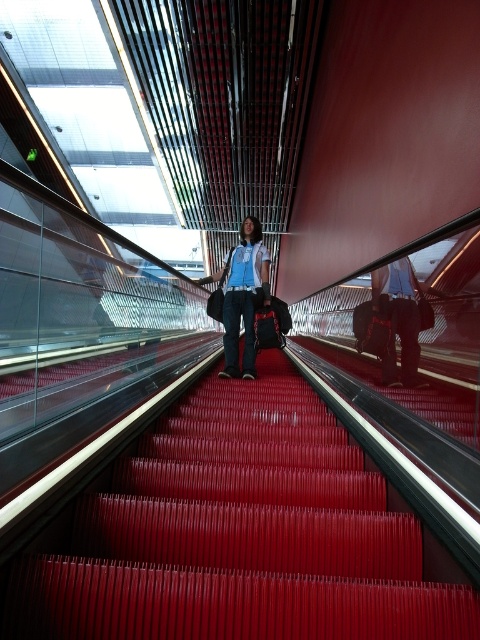
You are a delivery person carrying a box that is 1 meter wide. You need to walk down the red rubber stairs at center while wearing a matte blue shirt at center. Can the box fit through the stairs without getting stuck?

The red rubber stairs at center has a width larger than the matte blue shirt at center. Since the box is 1 meter wide, and the stairs are wider than the shirt, the box should fit through the stairs without getting stuck.

You are standing at the top of the moving escalator and looking down. There is a point marked at coordinates (x=239, y=534). What object is located at that point?

The point at coordinates (x=239, y=534) has red rubber stairs at center.

You are standing on the ascending escalator and want to reach the point closer to you. Which point should you move towards, point (115, 577) or point (389, 280)?

Point (115, 577) is closer to the viewer than point (389, 280), so you should move towards point (115, 577).